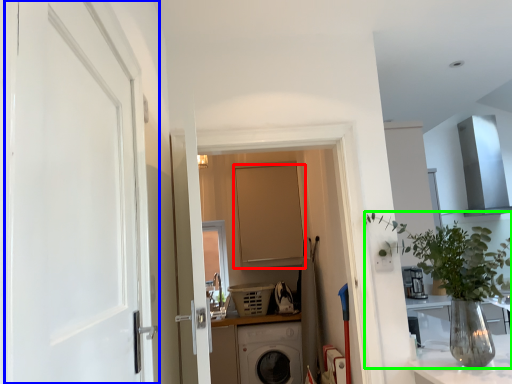
Question: Which is nearer to the door (highlighted by a red box)? door (highlighted by a blue box) or houseplant (highlighted by a green box).

Choices:
 (A) door
 (B) houseplant

Answer: (B)